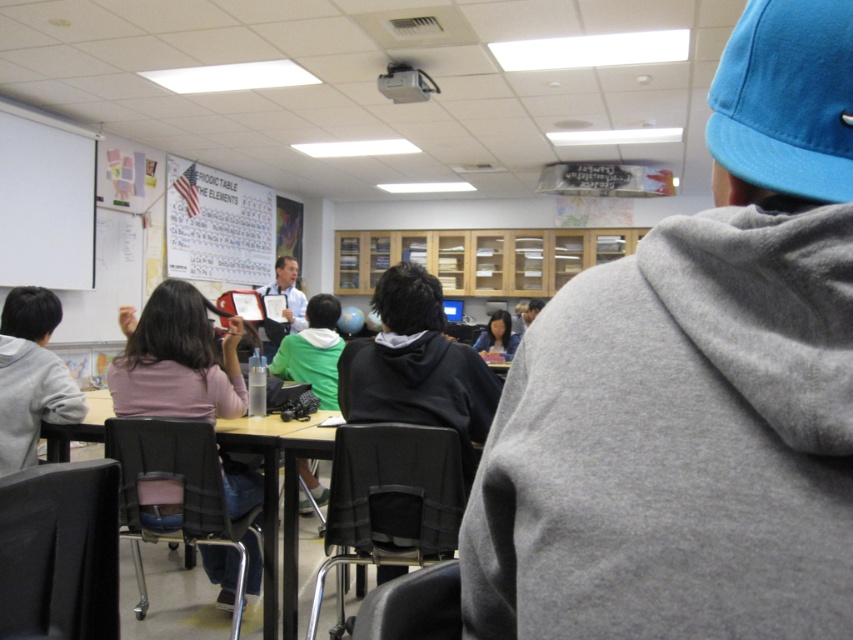
The image size is (853, 640). I want to click on blue fabric cap at upper right, so click(694, 388).

Is point (769, 106) closer to camera compared to point (308, 432)?

Yes, point (769, 106) is in front of point (308, 432).

Is point (793, 4) farther from viewer compared to point (297, 566)?

That is False.

Between point (706, 138) and point (267, 419), which one is positioned behind?

The point (267, 419) is more distant.

The width and height of the screenshot is (853, 640). I want to click on blue fabric baseball cap at upper right, so click(786, 99).

Which is more to the left, blue fabric baseball cap at upper right or green matte shirt at center?

green matte shirt at center

Is the position of blue fabric baseball cap at upper right more distant than that of green matte shirt at center?

No, blue fabric baseball cap at upper right is in front of green matte shirt at center.

At what (x,y) coordinates should I click in order to perform the action: click on blue fabric baseball cap at upper right. Please return your answer as a coordinate pair (x, y). Image resolution: width=853 pixels, height=640 pixels. Looking at the image, I should click on 786,99.